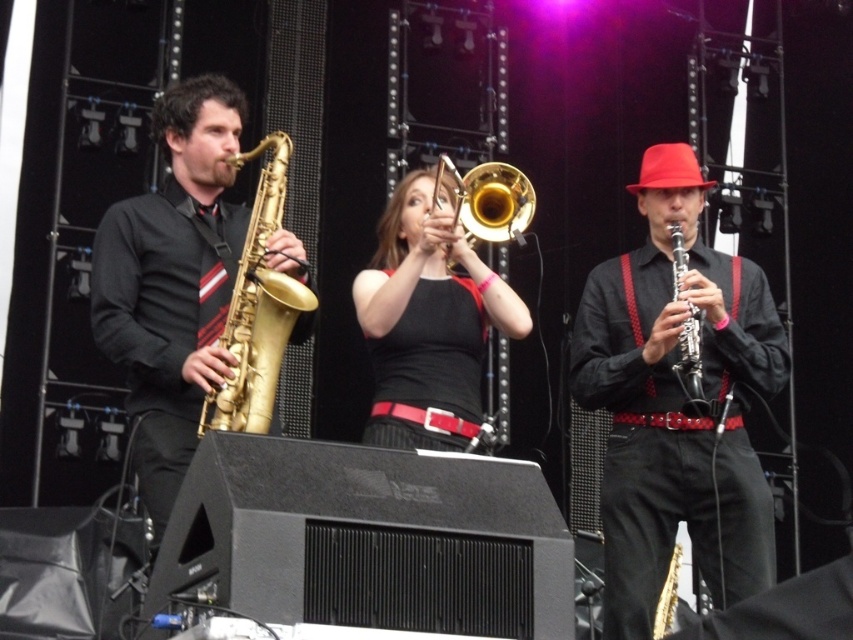
Is point (125, 365) more distant than point (699, 336)?

That is False.

Can you confirm if gold lacquered saxophone at left is positioned to the right of black wood clarinet at center?

No, gold lacquered saxophone at left is not to the right of black wood clarinet at center.

Locate an element on the screen. The width and height of the screenshot is (853, 640). gold lacquered saxophone at left is located at coordinates (172, 282).

Is gold lacquered saxophone at left closer to camera compared to gold brass trumpet at center?

Yes.

Based on the photo, is gold lacquered saxophone at left smaller than gold brass trumpet at center?

No.

Between point (222, 132) and point (288, 301), which one is positioned in front?

Point (288, 301) is more forward.

Where is `gold lacquered saxophone at left`? This screenshot has width=853, height=640. gold lacquered saxophone at left is located at coordinates (172, 282).

Describe the element at coordinates (428, 321) in the screenshot. The height and width of the screenshot is (640, 853). I see `gold shiny trombone at center` at that location.

Is gold shiny trombone at center positioned behind gold brass trumpet at center?

Yes, it is.

Who is more distant from viewer, (399, 374) or (223, 424)?

The point (399, 374) is behind.

What are the coordinates of `gold shiny trombone at center` in the screenshot? It's located at (428, 321).